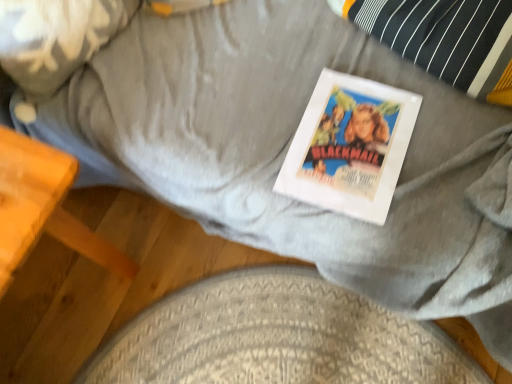
Where is `vacant region above white paper at center (from a real-world perspective)`? vacant region above white paper at center (from a real-world perspective) is located at coordinates [356, 140].